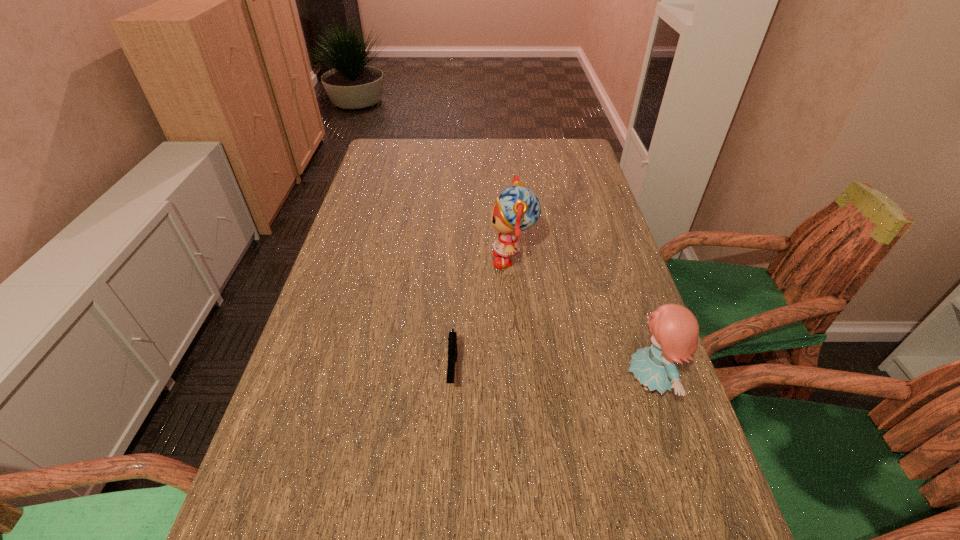
Where is `the farthest object`? The height and width of the screenshot is (540, 960). the farthest object is located at coordinates (517, 209).

Locate an element on the screen. This screenshot has height=540, width=960. the farther doll is located at coordinates (517, 209).

Identify the location of the rightmost object. This screenshot has width=960, height=540. (675, 330).

In order to click on the right doll in this screenshot , I will do 675,330.

Find the location of a particular element. This screenshot has width=960, height=540. pistol is located at coordinates (452, 340).

Find the location of `the leftmost object`. the leftmost object is located at coordinates (452, 340).

This screenshot has height=540, width=960. What are the coordinates of `vacant space located on the face of the farther doll` in the screenshot? It's located at (345, 259).

The height and width of the screenshot is (540, 960). In order to click on free space located 0.250m on the face of the farther doll in this screenshot , I will do `click(396, 259)`.

This screenshot has width=960, height=540. I want to click on vacant space situated 0.120m on the face of the farther doll, so click(x=445, y=259).

The height and width of the screenshot is (540, 960). I want to click on vacant space located 0.340m on the front-facing side of the right doll, so click(x=457, y=383).